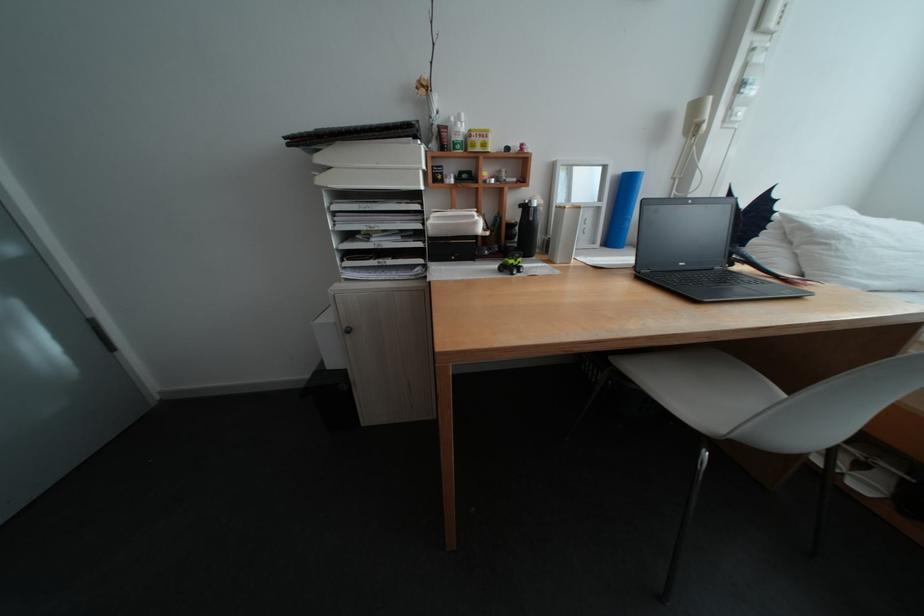
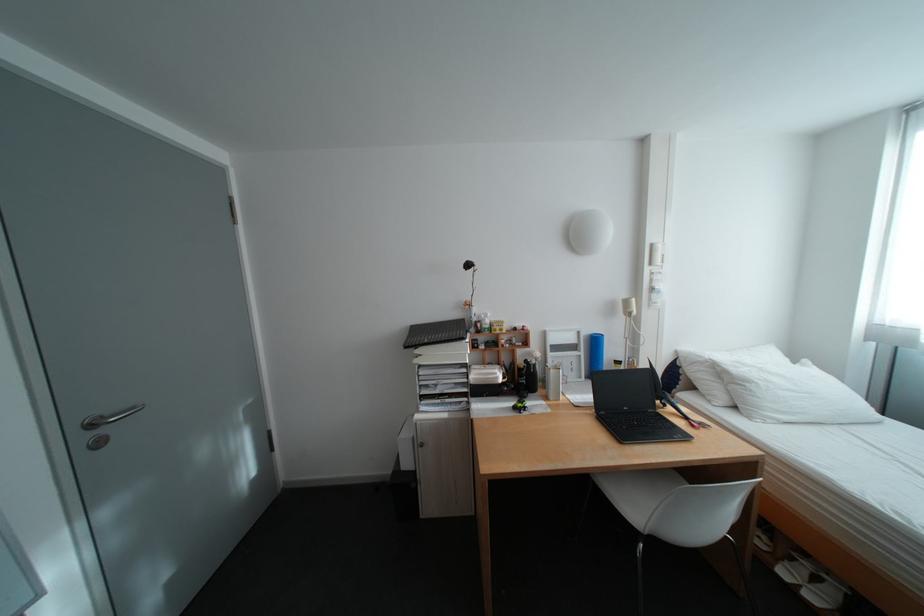
Where in the second image is the point corresponding to the point at 855,475 from the first image?

(813, 586)